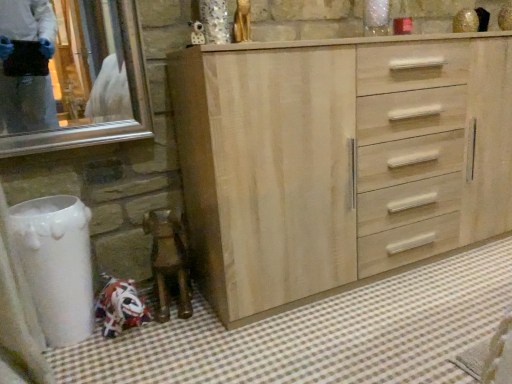
Measure the distance between point (270, 120) and camera.

Point (270, 120) is 4.02 feet from camera.

Image resolution: width=512 pixels, height=384 pixels. In order to click on light wood cabinet at center in this screenshot , I will do `click(337, 161)`.

What do you see at coordinates (337, 161) in the screenshot? I see `light wood cabinet at center` at bounding box center [337, 161].

What is the approximate width of white checkered bath mat at lower left?

white checkered bath mat at lower left is 6.57 feet wide.

Where is `white checkered bath mat at lower left`? The height and width of the screenshot is (384, 512). white checkered bath mat at lower left is located at coordinates (318, 334).

Image resolution: width=512 pixels, height=384 pixels. Describe the element at coordinates (318, 334) in the screenshot. I see `white checkered bath mat at lower left` at that location.

At what (x,y) coordinates should I click in order to perform the action: click on light wood cabinet at center. Please return your answer as a coordinate pair (x, y). Looking at the image, I should click on (337, 161).

Does white checkered bath mat at lower left appear on the left side of light wood cabinet at center?

Yes, white checkered bath mat at lower left is to the left of light wood cabinet at center.

Which object is further away from the camera, white checkered bath mat at lower left or light wood cabinet at center?

light wood cabinet at center.

Consider the image. Which is less distant, (161, 327) or (367, 73)?

A: Point (161, 327) is farther from the camera than point (367, 73).

From the image's perspective, between white checkered bath mat at lower left and light wood cabinet at center, which one is located above?

light wood cabinet at center is shown above in the image.

From a real-world perspective, between white checkered bath mat at lower left and light wood cabinet at center, who is vertically higher?

From a 3D spatial view, light wood cabinet at center is above.

Between white checkered bath mat at lower left and light wood cabinet at center, which one has smaller width?

With smaller width is light wood cabinet at center.

Which of these two, white checkered bath mat at lower left or light wood cabinet at center, stands shorter?

white checkered bath mat at lower left.

Is white checkered bath mat at lower left smaller than light wood cabinet at center?

Indeed, white checkered bath mat at lower left has a smaller size compared to light wood cabinet at center.

Is light wood cabinet at center inside white checkered bath mat at lower left?

Definitely not — light wood cabinet at center is not inside white checkered bath mat at lower left.

Are white checkered bath mat at lower left and light wood cabinet at center making contact?

white checkered bath mat at lower left and light wood cabinet at center are clearly separated.

Is white checkered bath mat at lower left oriented towards light wood cabinet at center?

No, white checkered bath mat at lower left does not turn towards light wood cabinet at center.

Based on the photo, what's the angular difference between white checkered bath mat at lower left and light wood cabinet at center's facing directions?

white checkered bath mat at lower left and light wood cabinet at center are facing 90.9 degrees away from each other.

What are the coordinates of `bath mat below the light wood cabinet at center (from the image's perspective)` in the screenshot? It's located at (318, 334).

Visually, is light wood cabinet at center positioned to the left or to the right of white checkered bath mat at lower left?

Clearly, light wood cabinet at center is on the right of white checkered bath mat at lower left in the image.

Relative to white checkered bath mat at lower left, is light wood cabinet at center in front or behind?

light wood cabinet at center is positioned farther from the viewer than white checkered bath mat at lower left.

Is point (250, 318) positioned behind point (434, 278)?

That is False.

From the image's perspective, is light wood cabinet at center on top of white checkered bath mat at lower left?

Yes, from the image's perspective, light wood cabinet at center is above white checkered bath mat at lower left.

From a real-world perspective, is light wood cabinet at center under white checkered bath mat at lower left?

No, from a real-world perspective, light wood cabinet at center is not beneath white checkered bath mat at lower left.

Considering the relative sizes of light wood cabinet at center and white checkered bath mat at lower left in the image provided, is light wood cabinet at center thinner than white checkered bath mat at lower left?

Indeed, light wood cabinet at center has a lesser width compared to white checkered bath mat at lower left.

Is light wood cabinet at center taller or shorter than white checkered bath mat at lower left?

light wood cabinet at center is taller than white checkered bath mat at lower left.

Who is bigger, light wood cabinet at center or white checkered bath mat at lower left?

Bigger between the two is light wood cabinet at center.

Is light wood cabinet at center not within white checkered bath mat at lower left?

Yes, light wood cabinet at center is outside of white checkered bath mat at lower left.

Is light wood cabinet at center touching white checkered bath mat at lower left?

No, light wood cabinet at center is not next to white checkered bath mat at lower left.

Is light wood cabinet at center aimed at white checkered bath mat at lower left?

Yes.

Where is `the chest of drawers behind the white checkered bath mat at lower left`? The image size is (512, 384). the chest of drawers behind the white checkered bath mat at lower left is located at coordinates (337, 161).

Locate an element on the screen. The image size is (512, 384). bath mat in front of the light wood cabinet at center is located at coordinates (318, 334).

The image size is (512, 384). What are the coordinates of `chest of drawers behind the white checkered bath mat at lower left` in the screenshot? It's located at [337, 161].